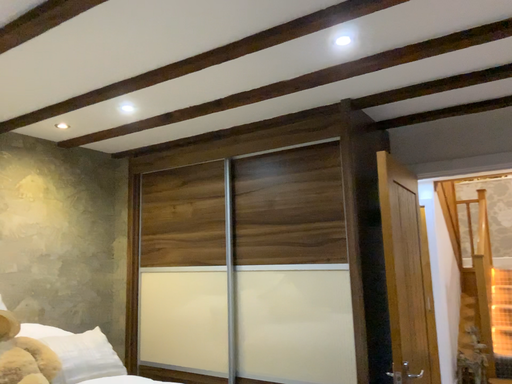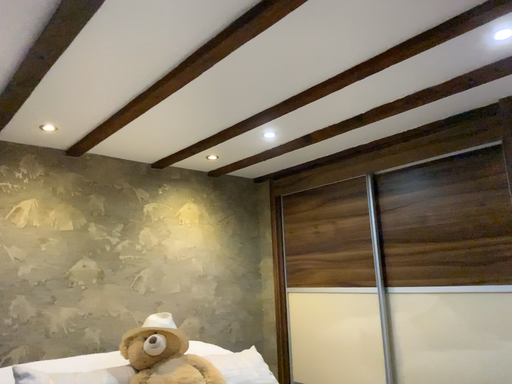
Question: Which way did the camera rotate in the video?

Choices:
 (A) rotated right
 (B) rotated left

Answer: (B)